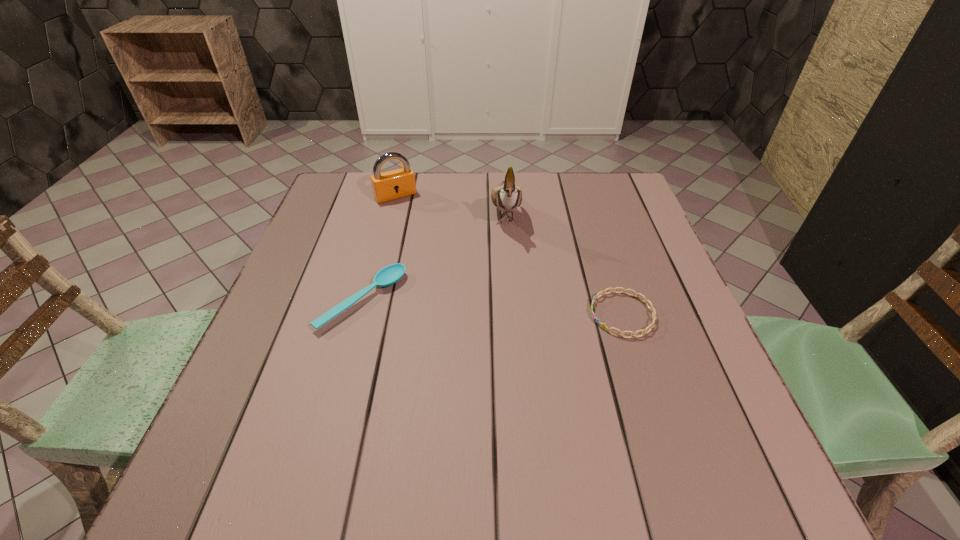
You are a GUI agent. You are given a task and a screenshot of the screen. Output one action in this format:
    pyautogui.click(x=<x>, y=<y>)
    Task: Click on the vacant space located at the face of the tallest object
    
    Given the screenshot: What is the action you would take?
    pyautogui.click(x=518, y=371)

Where is `free space located at the face of the tallest object`? This screenshot has width=960, height=540. free space located at the face of the tallest object is located at coordinates (514, 320).

Identify the location of free spot located to unlock the padlock from the front. The height and width of the screenshot is (540, 960). (424, 235).

The height and width of the screenshot is (540, 960). I want to click on free space located 0.150m to unlock the padlock from the front, so click(421, 231).

Locate an element on the screen. Image resolution: width=960 pixels, height=540 pixels. vacant space located 0.330m to unlock the padlock from the front is located at coordinates (449, 272).

Find the location of a particular element. bird that is at the far edge is located at coordinates (507, 197).

At what (x,y) coordinates should I click in order to perform the action: click on padlock that is at the far edge. Please return your answer as a coordinate pair (x, y). This screenshot has width=960, height=540. Looking at the image, I should click on (394, 184).

At what (x,y) coordinates should I click in order to perform the action: click on spoon present at the left edge. Please return your answer as a coordinate pair (x, y). Looking at the image, I should click on coord(389,275).

Where is `padlock that is at the left edge`? padlock that is at the left edge is located at coordinates (394, 184).

In order to click on object present at the right edge in this screenshot , I will do click(x=645, y=300).